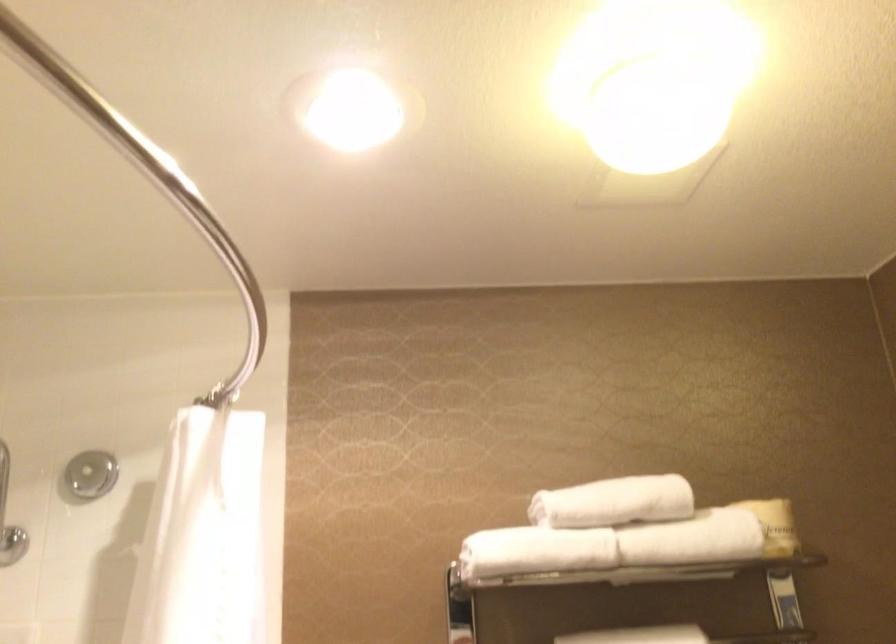
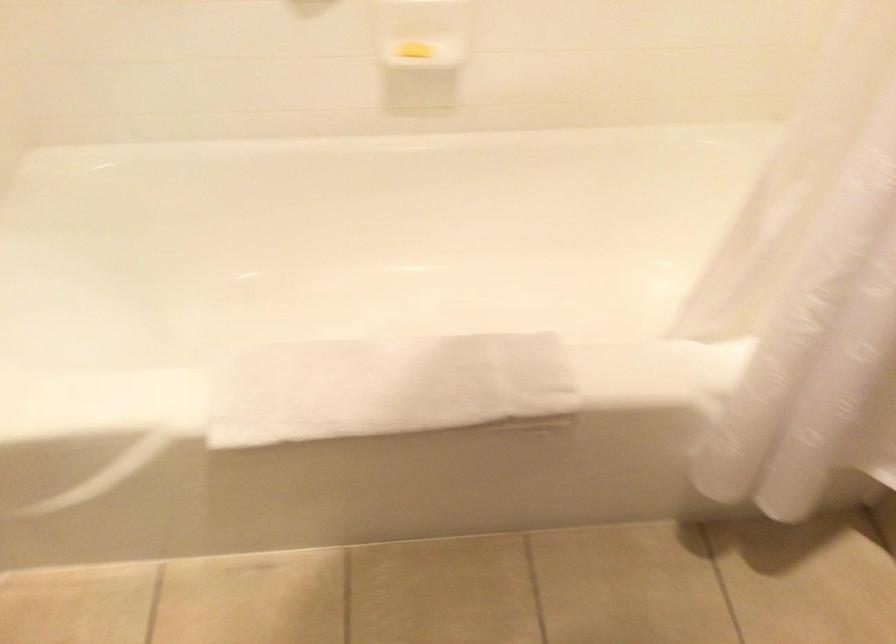
First-person continuous shooting, in which direction is the camera rotating?

The camera rotated toward left-down.